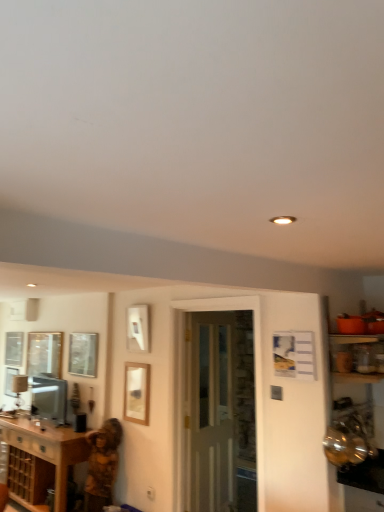
Question: Is clear glass window at center, placed as the 2th window when sorted from front to back, shorter than matte silver television at lower left?

Choices:
 (A) yes
 (B) no

Answer: (B)

Question: Is clear glass window at center, the 2th window positioned from the right, positioned with its back to matte silver television at lower left?

Choices:
 (A) yes
 (B) no

Answer: (B)

Question: From the image's perspective, is clear glass window at center, the 2th window positioned from the right, above matte silver television at lower left?

Choices:
 (A) no
 (B) yes

Answer: (B)

Question: From a real-world perspective, is clear glass window at center, placed as the 2th window when sorted from front to back, positioned over matte silver television at lower left based on gravity?

Choices:
 (A) yes
 (B) no

Answer: (A)

Question: From a real-world perspective, is clear glass window at center, the 2th window positioned from the right, under matte silver television at lower left?

Choices:
 (A) yes
 (B) no

Answer: (B)

Question: Does clear glass window at center, the first window when ordered from back to front, have a greater width compared to matte silver television at lower left?

Choices:
 (A) no
 (B) yes

Answer: (A)

Question: Could you tell me if clear glass window at center, placed as the 2th window when sorted from front to back, is facing brown wood cabinet at lower left?

Choices:
 (A) yes
 (B) no

Answer: (B)

Question: From the image's perspective, does clear glass window at center, the 1th window positioned from the left, appear higher than brown wood cabinet at lower left?

Choices:
 (A) no
 (B) yes

Answer: (B)

Question: Is clear glass window at center, the 2th window positioned from the right, behind brown wood cabinet at lower left?

Choices:
 (A) no
 (B) yes

Answer: (B)

Question: Is brown wood cabinet at lower left at the back of clear glass window at center, the 2th window positioned from the right?

Choices:
 (A) no
 (B) yes

Answer: (A)

Question: From a real-world perspective, is clear glass window at center, the first window when ordered from back to front, under brown wood cabinet at lower left?

Choices:
 (A) no
 (B) yes

Answer: (A)

Question: Is clear glass window at center, the 1th window positioned from the left, smaller than brown wood cabinet at lower left?

Choices:
 (A) yes
 (B) no

Answer: (A)

Question: Can you confirm if clear glass door at center is positioned to the left of wooden picture frame at center?

Choices:
 (A) yes
 (B) no

Answer: (B)